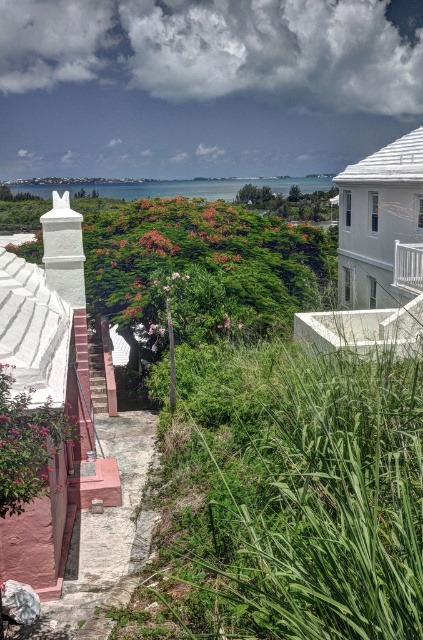
You are standing at the point with coordinates point (302,184) and want to walk to the point with coordinates point (412,273). Which direction should you move relative to your current position?

You should move forward because point (302,184) is behind point (412,273), so moving forward from your current position will take you towards the desired point.

You are standing at the bottom of the hillside and want to reach the white metal railing at upper right. If your maximum comfortable walking distance is 50 feet, can you comfortably walk to it without needing a break?

The white metal railing at upper right is 66.07 feet away from the viewer, which exceeds your maximum comfortable walking distance of 50 feet. Therefore, you may need to take a break before reaching it.